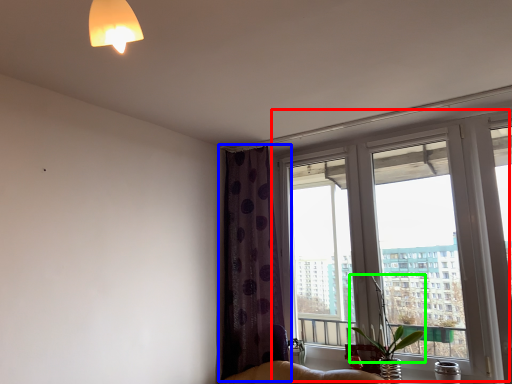
Question: Which object is positioned closest to window (highlighted by a red box)? Select from curtain (highlighted by a blue box) and plant (highlighted by a green box).

Choices:
 (A) curtain
 (B) plant

Answer: (A)